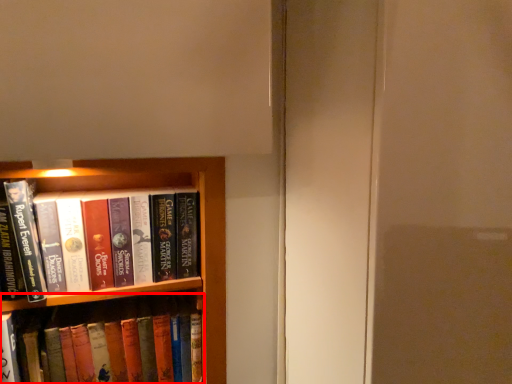
Question: Considering the relative positions of book (annotated by the red box) and book in the image provided, where is book (annotated by the red box) located with respect to the staircase?

Choices:
 (A) left
 (B) right

Answer: (A)